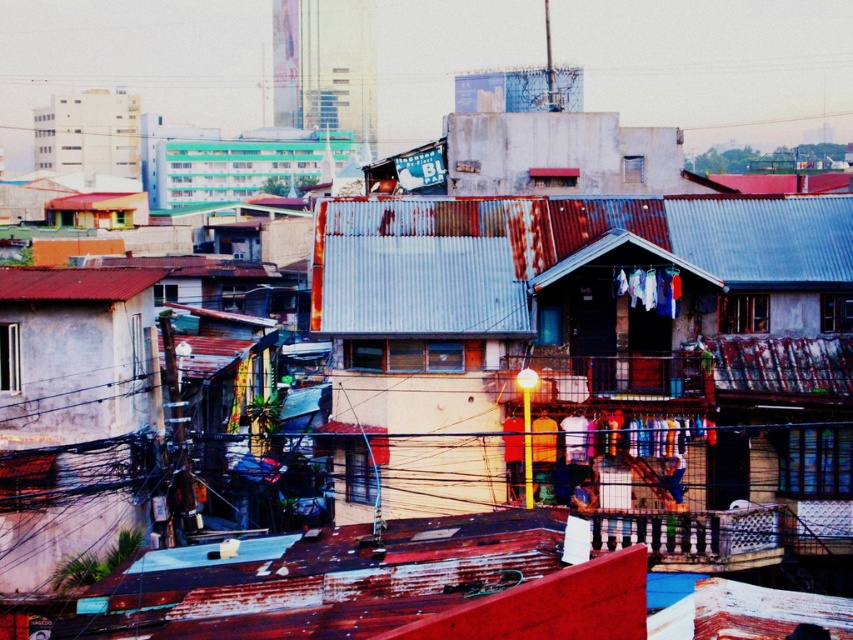
You are standing at the point with coordinates point (238, 164) in this urban neighborhood. What structure are you at?

The point (238, 164) corresponds to the teal plastic building at upper center.

You are a city planner assessing the urban layout. You need to determine if the rusty corrugated metal roof at center can fit entirely within the space occupied by the teal plastic building at upper center based on their widths. Can it?

The rusty corrugated metal roof at center has a smaller width than the teal plastic building at upper center, so it can fit entirely within the space occupied by the teal plastic building at upper center.